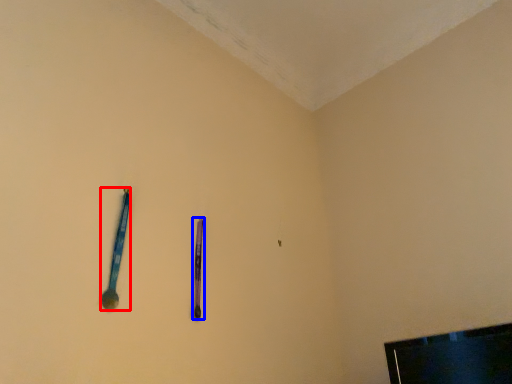
Question: Which object is further to the camera taking this photo, spoon (highlighted by a red box) or writing (highlighted by a blue box)?

Choices:
 (A) spoon
 (B) writing

Answer: (B)